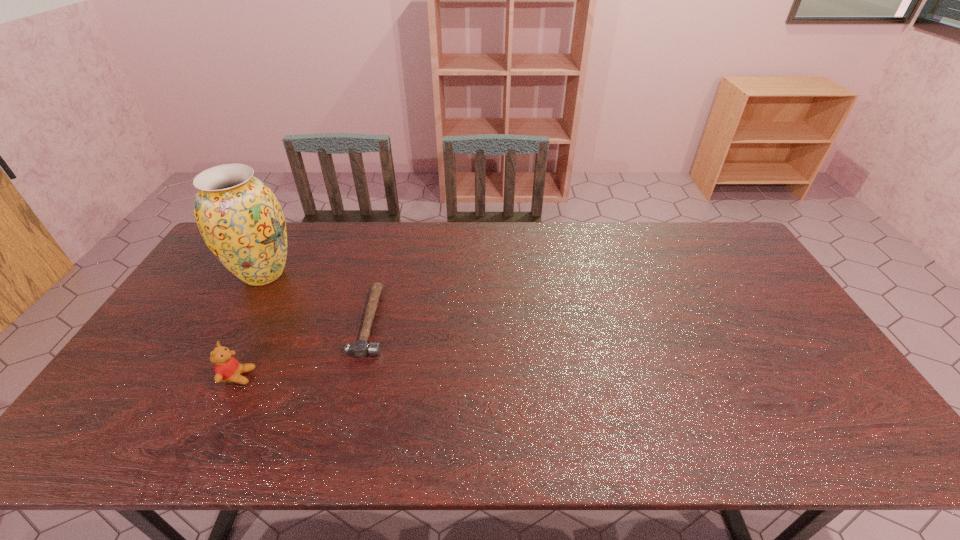
This screenshot has width=960, height=540. Identify the location of vase. (241, 221).

Image resolution: width=960 pixels, height=540 pixels. I want to click on the second tallest object, so click(227, 369).

The image size is (960, 540). I want to click on the nearest object, so click(227, 369).

Where is `the rightmost object`? The image size is (960, 540). the rightmost object is located at coordinates (360, 348).

Where is `the shortest object`? This screenshot has width=960, height=540. the shortest object is located at coordinates (360, 348).

At what (x,y) coordinates should I click in order to perform the action: click on vacant point located 0.250m on the front of the vase. Please return your answer as a coordinate pair (x, y). Looking at the image, I should click on (213, 363).

You are a GUI agent. You are given a task and a screenshot of the screen. Output one action in this format:
    pyautogui.click(x=<x>, y=<y>)
    Task: Click on the vacant area situated 0.210m on the front-facing side of the second shortest object
    The height and width of the screenshot is (540, 960).
    Given the screenshot: What is the action you would take?
    pyautogui.click(x=334, y=376)

I want to click on free space located 0.080m on the striking face of the shortest object, so click(415, 321).

At what (x,y) coordinates should I click in order to perform the action: click on object located in the far edge section of the desktop. Please return your answer as a coordinate pair (x, y). This screenshot has height=540, width=960. Looking at the image, I should click on (241, 221).

Locate an element on the screen. object that is at the left edge is located at coordinates (241, 221).